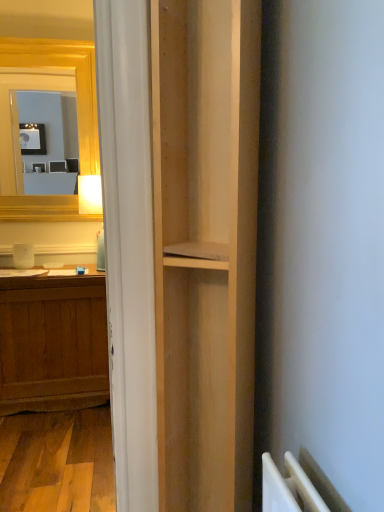
Measure the distance between point (108, 453) and camera.

The depth of point (108, 453) is 6.58 feet.

What do you see at coordinates (51, 306) in the screenshot?
I see `wooden desk at left` at bounding box center [51, 306].

In order to click on wooden desk at left in this screenshot , I will do `click(51, 306)`.

This screenshot has height=512, width=384. What do you see at coordinates (205, 247) in the screenshot?
I see `natural wood bookshelf at center` at bounding box center [205, 247].

At what (x,y) coordinates should I click in order to perform the action: click on natural wood bookshelf at center. Please return your answer as a coordinate pair (x, y). Looking at the image, I should click on (205, 247).

Where is `wooden desk at left`? The image size is (384, 512). wooden desk at left is located at coordinates (51, 306).

Based on their positions, is natural wood bookshelf at center located to the left or right of wooden desk at left?

natural wood bookshelf at center is to the right of wooden desk at left.

Considering the positions of objects natural wood bookshelf at center and wooden desk at left in the image provided, who is behind, natural wood bookshelf at center or wooden desk at left?

wooden desk at left.

Does point (246, 9) lie behind point (26, 504)?

No, (246, 9) is closer to viewer.

Based on the photo, from the image's perspective, who appears lower, natural wood bookshelf at center or wooden desk at left?

wooden desk at left is shown below in the image.

From a real-world perspective, is natural wood bookshelf at center physically located above or below wooden desk at left?

In terms of real-world spatial position, natural wood bookshelf at center is above wooden desk at left.

Which object is thinner, natural wood bookshelf at center or wooden desk at left?

wooden desk at left.

From their relative heights in the image, would you say natural wood bookshelf at center is taller or shorter than wooden desk at left?

Considering their sizes, natural wood bookshelf at center has less height than wooden desk at left.

Based on the photo, which of these two, natural wood bookshelf at center or wooden desk at left, is bigger?

Bigger between the two is natural wood bookshelf at center.

Could wooden desk at left be considered to be inside natural wood bookshelf at center?

No, wooden desk at left is located outside of natural wood bookshelf at center.

Would you say natural wood bookshelf at center is a long distance from wooden desk at left?

Yes, natural wood bookshelf at center and wooden desk at left are quite far apart.

From the picture: Could you tell me if natural wood bookshelf at center is turned towards wooden desk at left?

No, natural wood bookshelf at center is not aimed at wooden desk at left.

What's the angular difference between natural wood bookshelf at center and wooden desk at left's facing directions?

32.5 degrees separate the facing orientations of natural wood bookshelf at center and wooden desk at left.

Where is `corridor behind the natural wood bookshelf at center`? This screenshot has width=384, height=512. corridor behind the natural wood bookshelf at center is located at coordinates (51, 306).

Which object is positioned more to the left, wooden desk at left or natural wood bookshelf at center?

From the viewer's perspective, wooden desk at left appears more on the left side.

Looking at this image, in the image, is wooden desk at left positioned in front of or behind natural wood bookshelf at center?

wooden desk at left is behind natural wood bookshelf at center.

Is point (68, 398) in front of point (226, 67)?

No.

From the image's perspective, between wooden desk at left and natural wood bookshelf at center, who is located below?

wooden desk at left.

In the scene shown: From a real-world perspective, between wooden desk at left and natural wood bookshelf at center, who is vertically higher?

natural wood bookshelf at center is physically above.

Looking at their sizes, would you say wooden desk at left is wider or thinner than natural wood bookshelf at center?

In the image, wooden desk at left appears to be more narrow than natural wood bookshelf at center.

Can you confirm if wooden desk at left is taller than natural wood bookshelf at center?

Correct, wooden desk at left is much taller as natural wood bookshelf at center.

Is wooden desk at left bigger than natural wood bookshelf at center?

Actually, wooden desk at left might be smaller than natural wood bookshelf at center.

Is wooden desk at left not inside natural wood bookshelf at center?

wooden desk at left is positioned outside natural wood bookshelf at center.

Based on the photo, are wooden desk at left and natural wood bookshelf at center beside each other?

wooden desk at left and natural wood bookshelf at center are clearly separated.

Is wooden desk at left aimed at natural wood bookshelf at center?

No, wooden desk at left is not facing towards natural wood bookshelf at center.

How many degrees apart are the facing directions of wooden desk at left and natural wood bookshelf at center?

32.5 degrees separate the facing orientations of wooden desk at left and natural wood bookshelf at center.

At what (x,y) coordinates should I click in order to perform the action: click on corridor that appears on the left of natural wood bookshelf at center. Please return your answer as a coordinate pair (x, y). Looking at the image, I should click on (51, 306).

The width and height of the screenshot is (384, 512). I want to click on bookshelf that is on the right side of wooden desk at left, so click(x=205, y=247).

Locate an element on the screen. corridor lying below the natural wood bookshelf at center (from the image's perspective) is located at coordinates (51, 306).